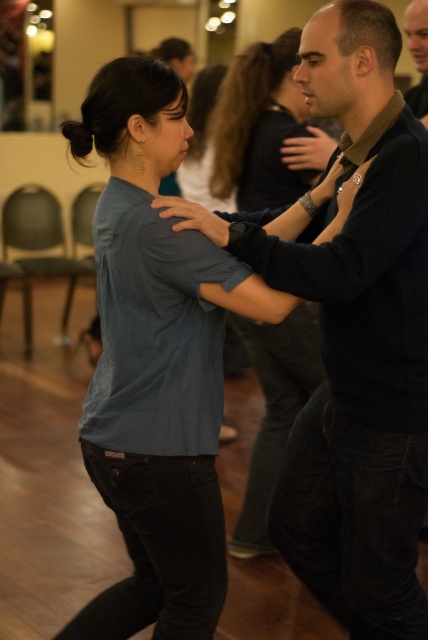
Between point (258, 451) and point (424, 81), which one is positioned in front?

Point (258, 451)

Between blue denim shirt at center and smooth black shirt at upper right, which one is positioned lower?

blue denim shirt at center is below.

What do you see at coordinates (261, 128) in the screenshot? I see `blue denim shirt at center` at bounding box center [261, 128].

The height and width of the screenshot is (640, 428). Find the location of `blue denim shirt at center`. blue denim shirt at center is located at coordinates (261, 128).